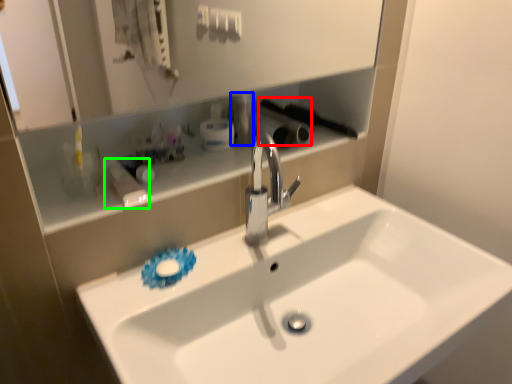
Question: Estimate the real-world distances between objects in this image. Which object is farther from brush (highlighted by a red box), toiletry (highlighted by a blue box) or toiletry (highlighted by a green box)?

Choices:
 (A) toiletry
 (B) toiletry

Answer: (B)